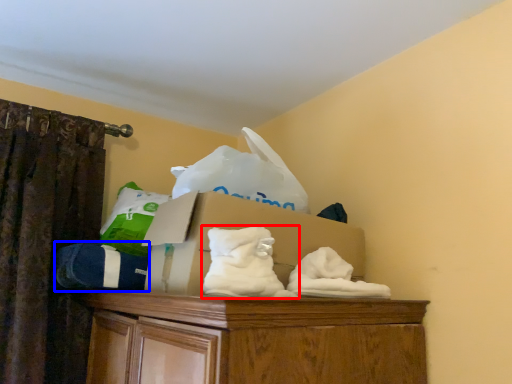
Question: Among these objects, which one is nearest to the camera, sheet (highlighted by a red box) or clothing (highlighted by a blue box)?

Choices:
 (A) sheet
 (B) clothing

Answer: (A)